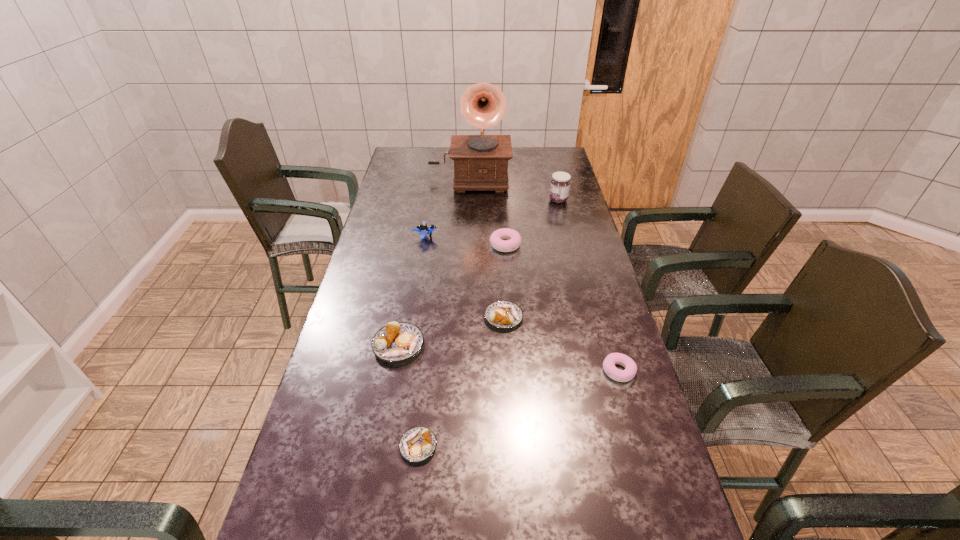
You are a GUI agent. You are given a task and a screenshot of the screen. Output one action in this format:
    pyautogui.click(x=<x>, y=<y>)
    Task: Click on the tallest object
    The width and height of the screenshot is (960, 540).
    Given the screenshot: What is the action you would take?
    pyautogui.click(x=480, y=161)

Find the location of `brown record player`. brown record player is located at coordinates (480, 161).

At what (x,y) coordinates should I click in order to perform the action: click on the second tallest object. Please return your answer as a coordinate pair (x, y). Looking at the image, I should click on (560, 183).

Identify the location of the seventh nearest object. The width and height of the screenshot is (960, 540). [560, 183].

The height and width of the screenshot is (540, 960). I want to click on blue Lego, so 423,229.

This screenshot has width=960, height=540. I want to click on the sixth shortest object, so click(423, 229).

Identify the location of the biggest brown pastry. (397, 341).

Identify the location of the farthest pastry. (504, 240).

You are a GUI agent. You are given a task and a screenshot of the screen. Output one action in this format:
    pyautogui.click(x=<x>, y=<y>)
    Task: Click on the bigger pink pastry
    The height and width of the screenshot is (540, 960).
    Given the screenshot: What is the action you would take?
    pyautogui.click(x=504, y=240)

Locate an element on the screen. Image resolution: width=960 pixels, height=540 pixels. the second smallest brown pastry is located at coordinates (503, 314).